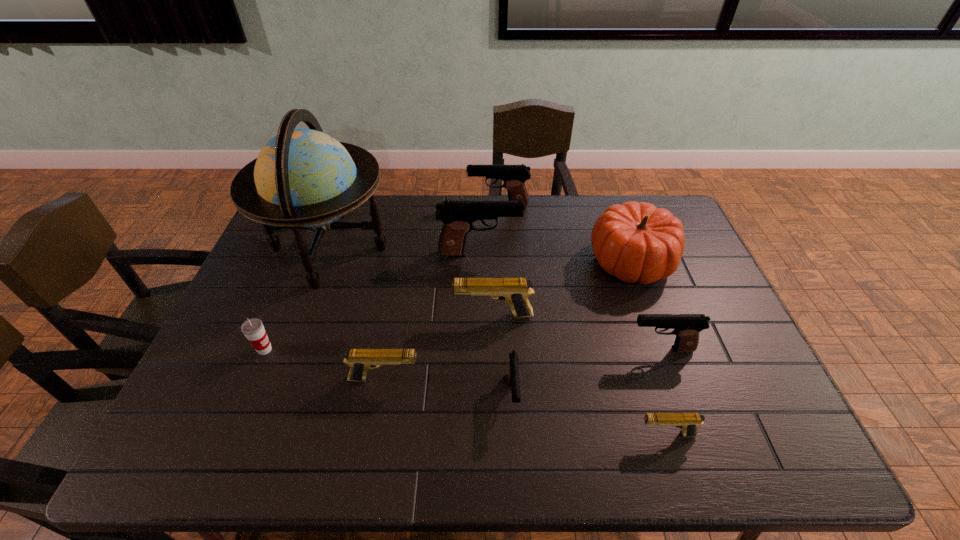
Locate an element on the screen. The height and width of the screenshot is (540, 960). unoccupied position between the tallest pistol and the red cup is located at coordinates (372, 301).

This screenshot has height=540, width=960. Find the location of `unoccupied position between the tallest object and the fifth nearest pistol`. unoccupied position between the tallest object and the fifth nearest pistol is located at coordinates (412, 282).

You are a GUI agent. You are given a task and a screenshot of the screen. Output one action in this format:
    pyautogui.click(x=<x>, y=<y>)
    Task: Click on the free space between the pumpkin and the red cup
    The height and width of the screenshot is (540, 960).
    Given the screenshot: What is the action you would take?
    pyautogui.click(x=448, y=306)

The height and width of the screenshot is (540, 960). In order to click on free space between the rightmost black pistol and the pumpkin in this screenshot , I will do `click(646, 305)`.

Locate an element on the screen. This screenshot has width=960, height=540. free area in between the second tan pistol from left to right and the red cup is located at coordinates tap(379, 333).

This screenshot has width=960, height=540. I want to click on unoccupied position between the cup and the tallest pistol, so click(372, 301).

This screenshot has width=960, height=540. In order to click on empty location between the nearest black pistol and the second farthest tan pistol in this screenshot , I will do `click(448, 387)`.

At what (x,y) coordinates should I click in order to perform the action: click on free space between the cup and the smallest tan pistol. Please return your answer as a coordinate pair (x, y). Looking at the image, I should click on 466,392.

This screenshot has height=540, width=960. What are the coordinates of `object that is the closest one to the pumpkin` in the screenshot? It's located at (687, 327).

At what (x,y) coordinates should I click in order to perform the action: click on object that is the eighth closest to the nearest tan pistol. Please return your answer as a coordinate pair (x, y). Image resolution: width=960 pixels, height=540 pixels. Looking at the image, I should click on (514, 176).